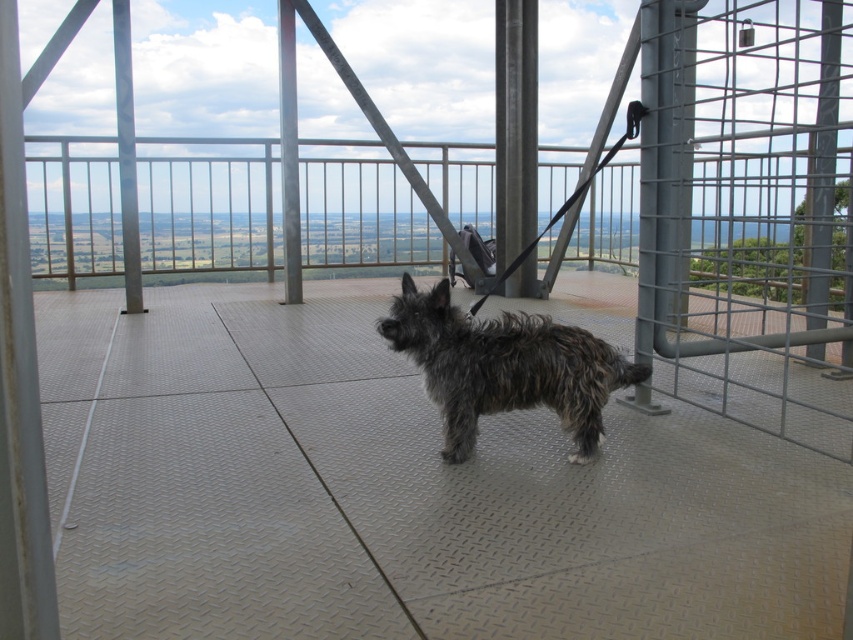
Question: Which point is farther to the camera?

Choices:
 (A) (741, 356)
 (B) (556, 394)

Answer: (A)

Question: Is metallic grid gate at right behind fuzzy brown dog at center?

Choices:
 (A) no
 (B) yes

Answer: (A)

Question: Which of the following is the closest to the observer?

Choices:
 (A) fuzzy brown dog at center
 (B) metallic grid gate at right

Answer: (B)

Question: Can you confirm if metallic grid gate at right is bigger than fuzzy brown dog at center?

Choices:
 (A) yes
 (B) no

Answer: (A)

Question: Does metallic grid gate at right appear on the right side of fuzzy brown dog at center?

Choices:
 (A) yes
 (B) no

Answer: (A)

Question: Among these objects, which one is farthest from the camera?

Choices:
 (A) metallic grid gate at right
 (B) fuzzy brown dog at center

Answer: (B)